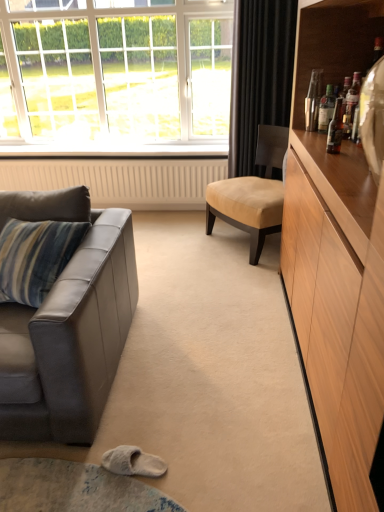
Question: Is white glass window at upper left to the left or to the right of beige textured radiator at lower center in the image?

Choices:
 (A) right
 (B) left

Answer: (A)

Question: Considering the positions of point (62, 62) and point (6, 170), is point (62, 62) closer or farther from the camera than point (6, 170)?

Choices:
 (A) closer
 (B) farther

Answer: (B)

Question: Which of these objects is positioned closest to the beige leather chair at center?

Choices:
 (A) leather couch at left
 (B) black velvet curtain at upper right
 (C) translucent glass bottle at upper right, marked as the first bottle in a front-to-back arrangement
 (D) shiny metallic bottle at upper right, which is the first bottle in back-to-front order
 (E) translucent glass bottle at upper right, acting as the 2th bottle starting from the front

Answer: (B)

Question: Which of these objects is positioned farthest from the leather couch at left?

Choices:
 (A) translucent glass bottle at upper right, acting as the 2th bottle starting from the front
 (B) beige leather chair at center
 (C) white glass window at upper left
 (D) translucent glass bottle at upper right, marked as the first bottle in a front-to-back arrangement
 (E) black velvet curtain at upper right

Answer: (C)